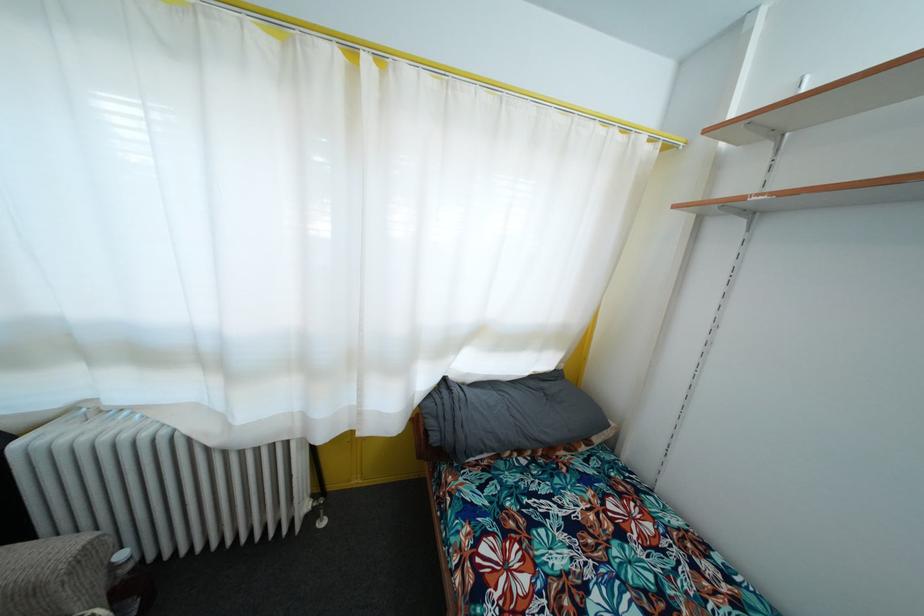
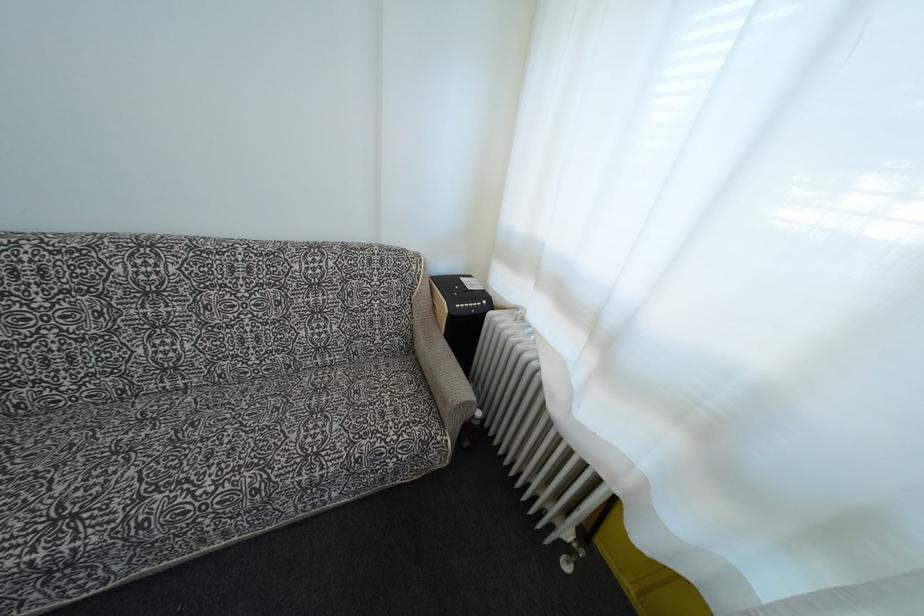
Where in the second image is the point corresponding to (x=94, y=548) from the first image?

(472, 408)